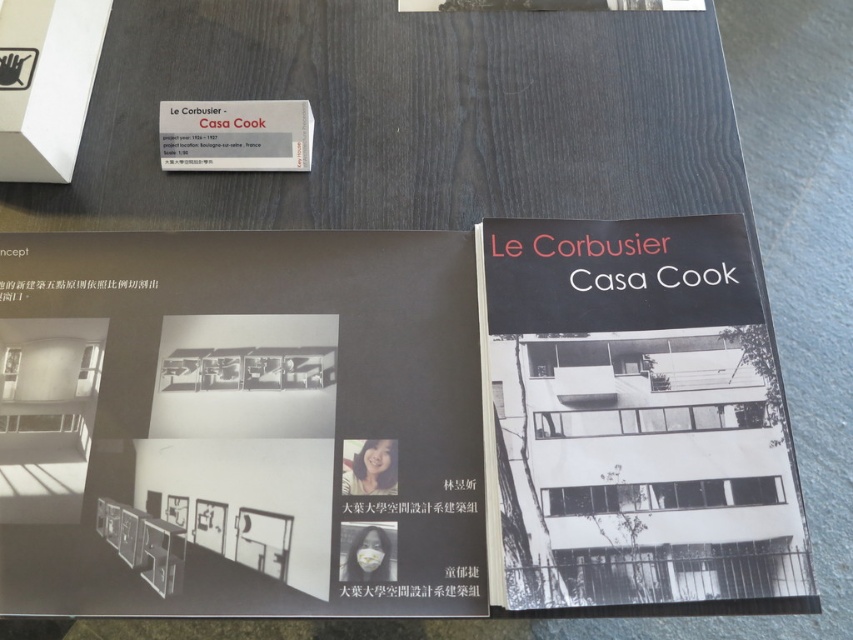
Question: Which of the following is the farthest from the observer?

Choices:
 (A) (554, 429)
 (B) (198, 118)

Answer: (B)

Question: Does black matte book at center have a smaller size compared to matte white paper at upper left?

Choices:
 (A) no
 (B) yes

Answer: (A)

Question: Which of the following is the closest to the observer?

Choices:
 (A) black matte book at center
 (B) matte white paper at upper left

Answer: (A)

Question: Does black matte book at center have a smaller size compared to matte white paper at upper left?

Choices:
 (A) no
 (B) yes

Answer: (A)

Question: Which point is closer to the camera?

Choices:
 (A) matte white paper at upper left
 (B) black matte book at center

Answer: (B)

Question: Is the position of black matte book at center less distant than that of matte white paper at upper left?

Choices:
 (A) yes
 (B) no

Answer: (A)